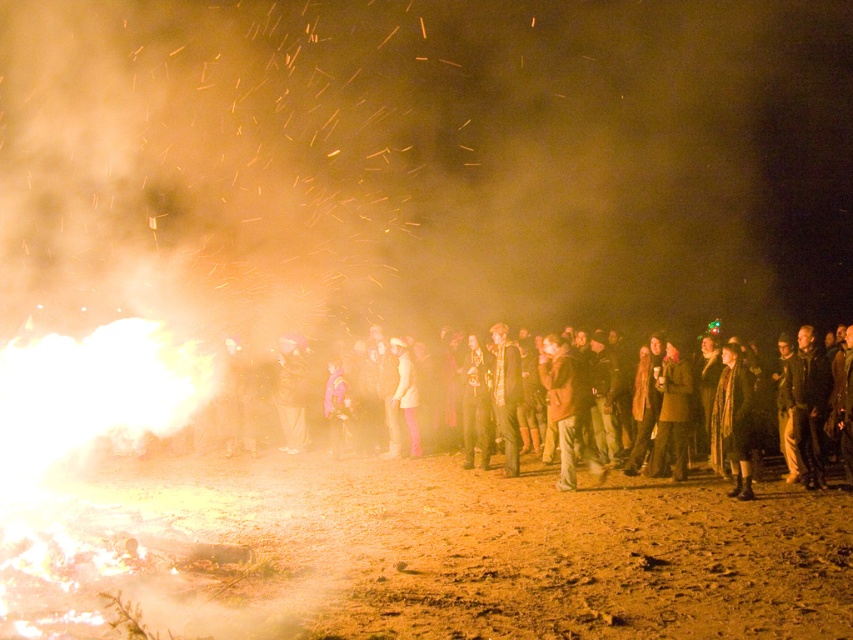
You are standing at the edge of the scene and want to walk towards the dark brown leather jackets at center. Which direction should you move relative to the brown sandy ground at lower left?

The brown sandy ground at lower left is above the dark brown leather jackets at center, so to reach the jackets, you should move downward from the brown sandy ground at lower left.

You are standing at the edge of the bonfire scene and want to move towards the center. There are two points marked in the image, point 1 at coordinates point (764, 486) and point 2 at coordinates point (790, 429). Which point should you aim for to get closer to the center of the crowd?

Point 1 at coordinates point (764, 486) is in front of point 2 at coordinates point (790, 429), so aiming for point 1 would bring you closer to the center of the crowd.